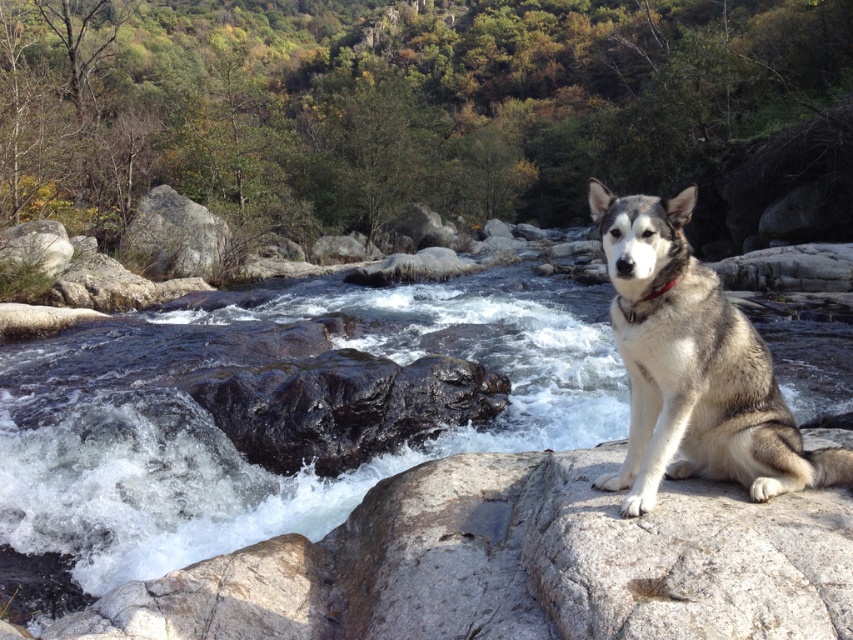
You are a photographer planning to take a photo of the gray fur dog at right and the clear water at stream right. Since you want both subjects to be in focus, which one should you focus on first to ensure proper depth of field?

Since the gray fur dog at right is behind the clear water at stream right, you should focus on the gray fur dog at right first to ensure both are in focus.

You are a hiker who wants to cross the river using the rocks. You see the clear water at stream right and the gray fur dog at right. Which object is closer to the left side of the river?

The clear water at stream right is positioned on the left side of gray fur dog at right, so it is closer to the left side of the river.